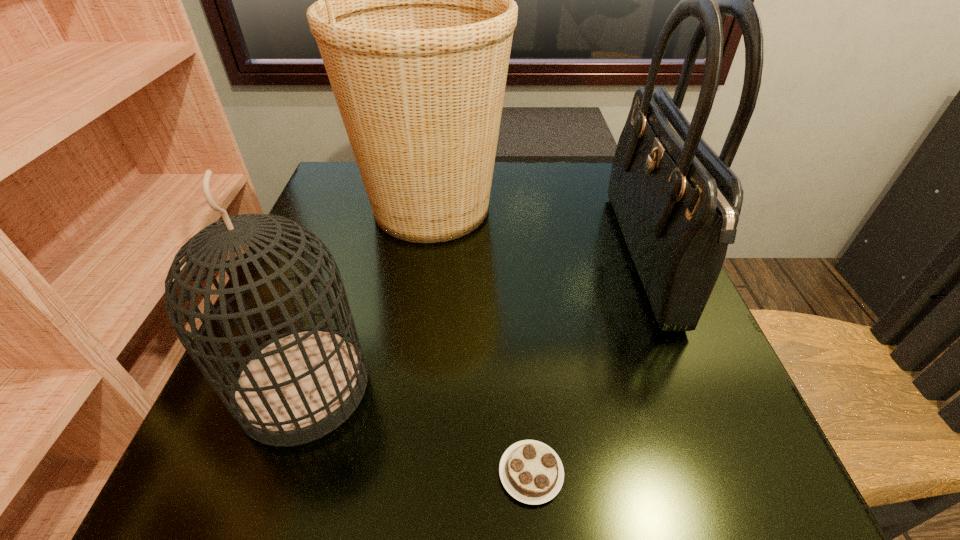
Locate an element on the screen. This screenshot has width=960, height=540. free spot between the birdcage and the basket is located at coordinates (368, 297).

Find the location of a particular element. This screenshot has height=540, width=960. vacant area that lies between the chocolate cake and the basket is located at coordinates (481, 340).

I want to click on vacant point located between the chocolate cake and the second shortest object, so click(x=418, y=430).

At what (x,y) coordinates should I click in order to perform the action: click on free space that is in between the third tallest object and the handbag. Please return your answer as a coordinate pair (x, y). Image resolution: width=960 pixels, height=540 pixels. Looking at the image, I should click on (473, 322).

Find the location of a particular element. vacant space that is in between the chocolate cake and the handbag is located at coordinates (587, 366).

The image size is (960, 540). Identify the location of free space that is in between the shortest object and the handbag. (587, 366).

Identify which object is the third closest to the rightmost object. Please provide its 2D coordinates. Your answer should be formatted as a tuple, i.e. [(x, y)], where the tuple contains the x and y coordinates of a point satisfying the conditions above.

[(297, 387)]

Find the location of a particular element. Image resolution: width=960 pixels, height=540 pixels. the closest object to the basket is located at coordinates (297, 387).